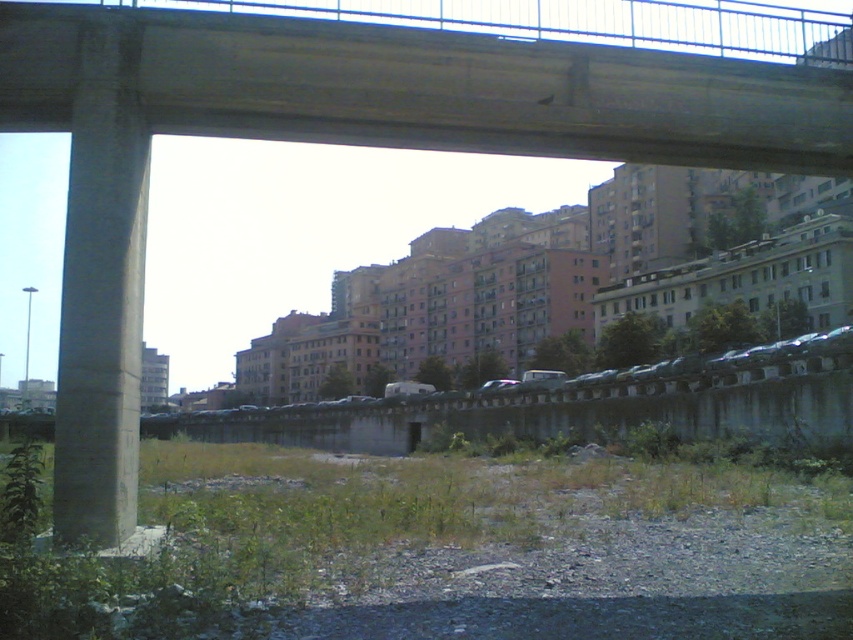
Is point (566, 33) less distant than point (62, 465)?

That is False.

Which is in front, point (757, 124) or point (85, 396)?

Positioned in front is point (85, 396).

Is point (775, 164) positioned before point (91, 332)?

That is False.

Locate an element on the screen. This screenshot has width=853, height=640. concrete at upper center is located at coordinates (418, 84).

Is the position of concrete at upper center less distant than that of green leafy weed at lower left?

That is False.

Describe the element at coordinates (418, 84) in the screenshot. I see `concrete at upper center` at that location.

I want to click on concrete at upper center, so click(418, 84).

Is the position of concrete at left more distant than that of green leafy weed at lower left?

Yes.

Which is in front, point (142, 163) or point (12, 525)?

Point (12, 525)

Who is more distant from viewer, (112, 365) or (10, 524)?

Positioned behind is point (112, 365).

Identify the location of concrete at left. The width and height of the screenshot is (853, 640). (102, 294).